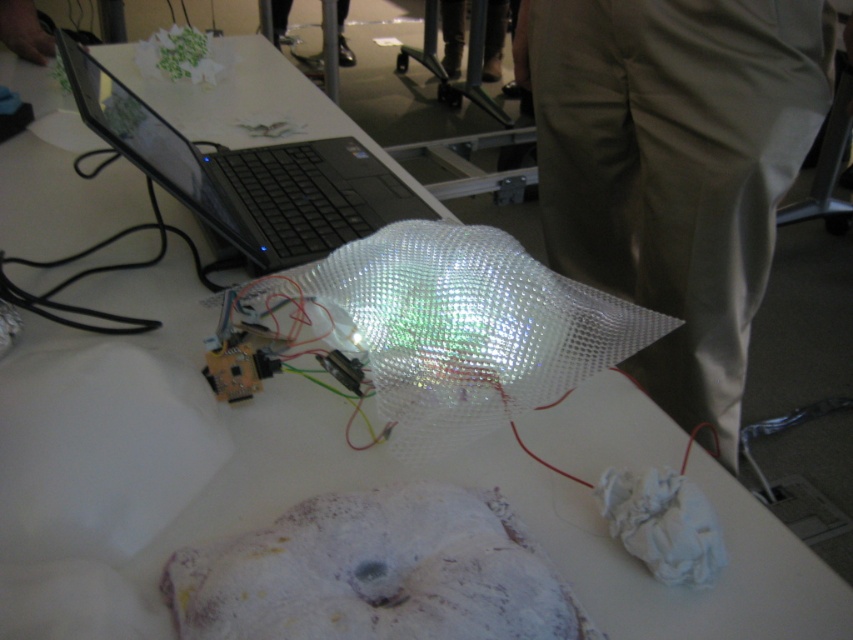
You are organizing items on the table and need to place the khaki cotton pants at right and the black glossy laptop at upper left. Which object has a smaller width?

The khaki cotton pants at right has a smaller width than the black glossy laptop at upper left according to the description.

You are organizing items on a table and need to place a new object between the khaki cotton pants at right and the black glossy laptop at upper left. Based on their positions, which item should you place the new object closer to?

The khaki cotton pants at right is closer to you than the black glossy laptop at upper left, so you should place the new object closer to the khaki cotton pants at right to maintain spatial order.